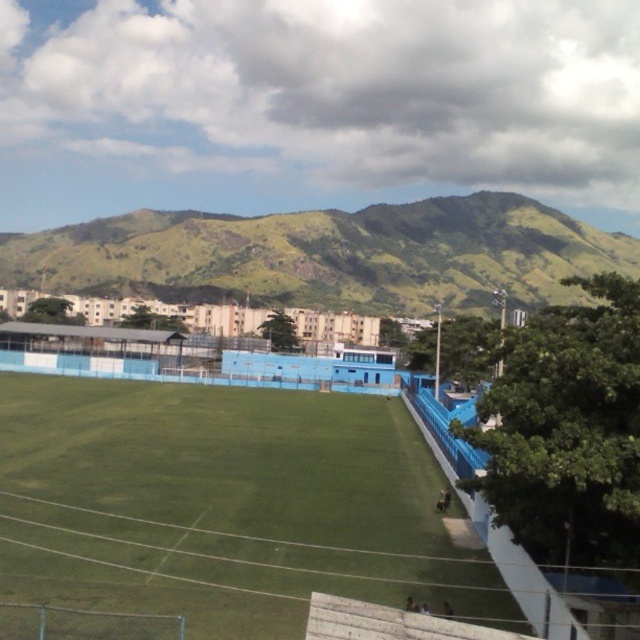
Consider the image. Does green grass football field at center have a larger size compared to green grassy hill at upper center?

No.

At what (x,y) coordinates should I click in order to perform the action: click on green grass football field at center. Please return your answer as a coordinate pair (x, y). The width and height of the screenshot is (640, 640). Looking at the image, I should click on (225, 504).